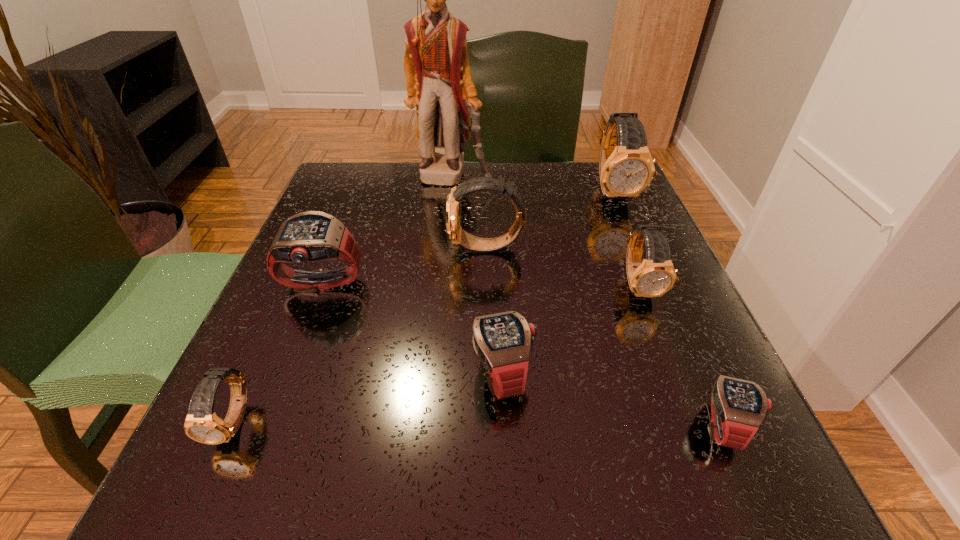
The height and width of the screenshot is (540, 960). Find the location of `the leftmost gold watch`. the leftmost gold watch is located at coordinates (202, 424).

Where is `the nearest gold watch`? Image resolution: width=960 pixels, height=540 pixels. the nearest gold watch is located at coordinates (202, 424).

You are a GUI agent. You are given a task and a screenshot of the screen. Output one action in this format:
    pyautogui.click(x=<x>, y=<y>)
    Task: Click on the rightmost red watch
    The height and width of the screenshot is (540, 960).
    Given the screenshot: What is the action you would take?
    pyautogui.click(x=738, y=407)

Locate an element on the screen. The height and width of the screenshot is (540, 960). the shortest watch is located at coordinates (738, 407).

The height and width of the screenshot is (540, 960). What are the coordinates of `free spot located 0.280m on the front-facing side of the red nutcracker` in the screenshot? It's located at (444, 269).

Find the location of a particular element. The height and width of the screenshot is (540, 960). vacant space located on the face of the farthest gold watch is located at coordinates (652, 284).

Identify the location of vacant space located on the face of the sixth nearest object. The height and width of the screenshot is (540, 960). [365, 248].

Where is `vacant area located 0.110m on the face of the sixth nearest object`? The width and height of the screenshot is (960, 540). vacant area located 0.110m on the face of the sixth nearest object is located at coordinates (395, 248).

At what (x,y) coordinates should I click in order to perform the action: click on vacant space located on the face of the sixth nearest object. Please return your answer as a coordinate pair (x, y). This screenshot has height=540, width=960. Looking at the image, I should click on point(345,248).

The width and height of the screenshot is (960, 540). Find the location of `free space located 0.390m on the right of the farthest red watch`. free space located 0.390m on the right of the farthest red watch is located at coordinates (578, 285).